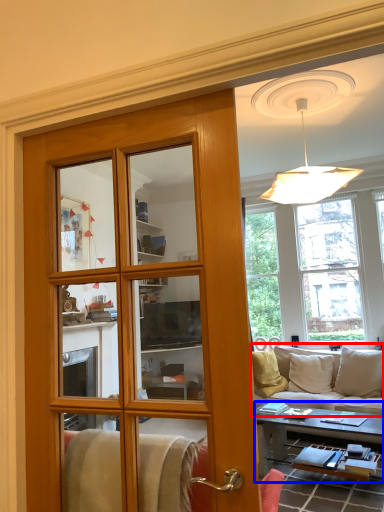
Question: Which of the following is the farthest to the observer, studio couch (highlighted by a red box) or table (highlighted by a blue box)?

Choices:
 (A) studio couch
 (B) table

Answer: (A)